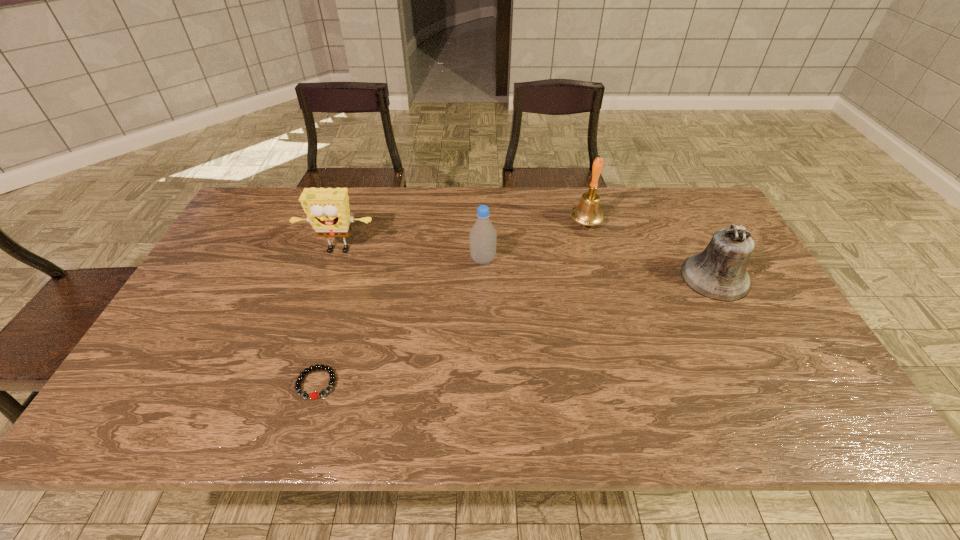
The image size is (960, 540). Find the location of `unoccupied position between the nearest object and the bottle`. unoccupied position between the nearest object and the bottle is located at coordinates (399, 321).

You are a GUI agent. You are given a task and a screenshot of the screen. Output one action in this format:
    pyautogui.click(x=<x>, y=<y>)
    Task: Click on the vacant point located between the left bell and the right bell
    
    Given the screenshot: What is the action you would take?
    pyautogui.click(x=650, y=249)

Where is `the third closest object relative to the sponge`? The height and width of the screenshot is (540, 960). the third closest object relative to the sponge is located at coordinates (587, 212).

You are a GUI agent. You are given a task and a screenshot of the screen. Output one action in this format:
    pyautogui.click(x=<x>, y=<y>)
    Task: Click on the object that is the second closest to the sponge
    The height and width of the screenshot is (540, 960).
    Given the screenshot: What is the action you would take?
    pyautogui.click(x=314, y=395)

At what (x,y) coordinates should I click in order to perform the action: click on vacant point that satisfies the following two spatial constraints: 1. on the front-facing side of the sponge; 2. on the left side of the rightmost object. Please return your answer as a coordinate pair (x, y). The image size is (960, 540). Looking at the image, I should click on (329, 278).

Find the location of a particular element. vacant space that satisfies the following two spatial constraints: 1. on the front-facing side of the sponge; 2. on the left side of the bottle is located at coordinates (335, 259).

Where is `vacant region that satisfies the following two spatial constraints: 1. on the front-facing side of the sponge; 2. on the right side of the nearer bell`? vacant region that satisfies the following two spatial constraints: 1. on the front-facing side of the sponge; 2. on the right side of the nearer bell is located at coordinates (329, 278).

What are the coordinates of `blank space that satisfies the following two spatial constraints: 1. on the front-facing side of the sponge; 2. on the left side of the rightmost object` in the screenshot? It's located at (329, 278).

Image resolution: width=960 pixels, height=540 pixels. Identify the location of vacant position in the image that satisfies the following two spatial constraints: 1. on the front-facing side of the sponge; 2. on the right side of the nearest object. pyautogui.click(x=293, y=383).